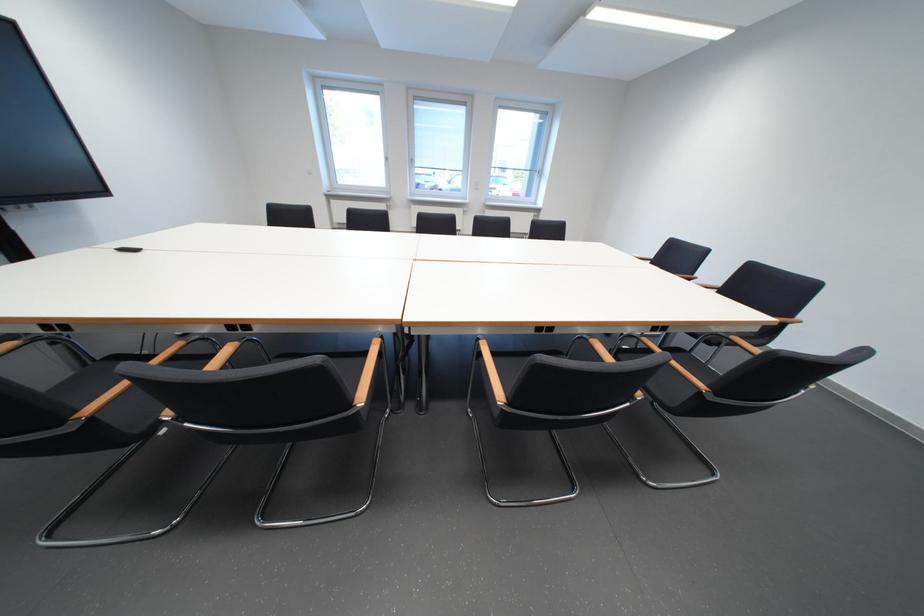
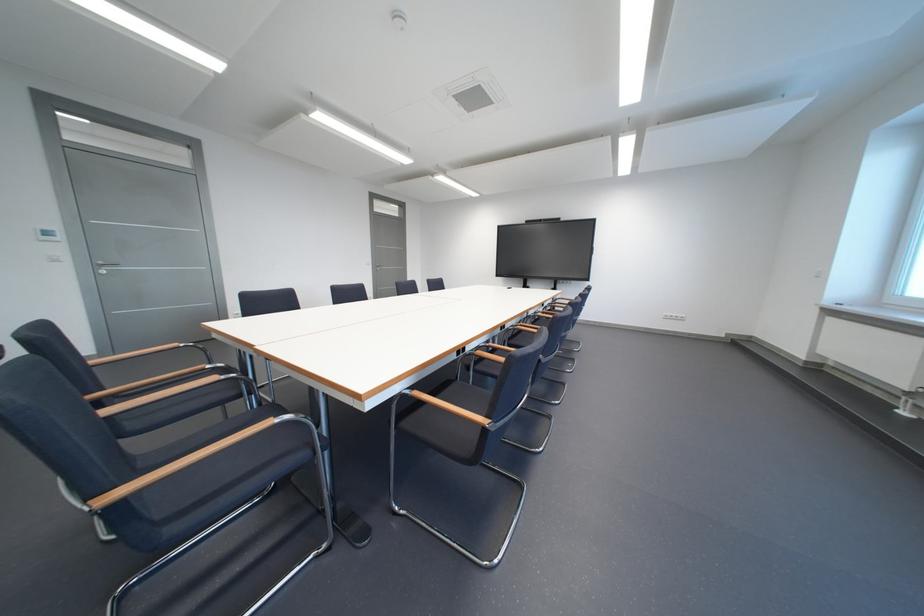
Question: I am providing you with two images of the same scene from different viewpoints. Which of the following objects are not visible in image2?

Choices:
 (A) wooden chair armrest
 (B) chair sitting surface
 (C) yellow lid jar
 (D) white light switch

Answer: (B)